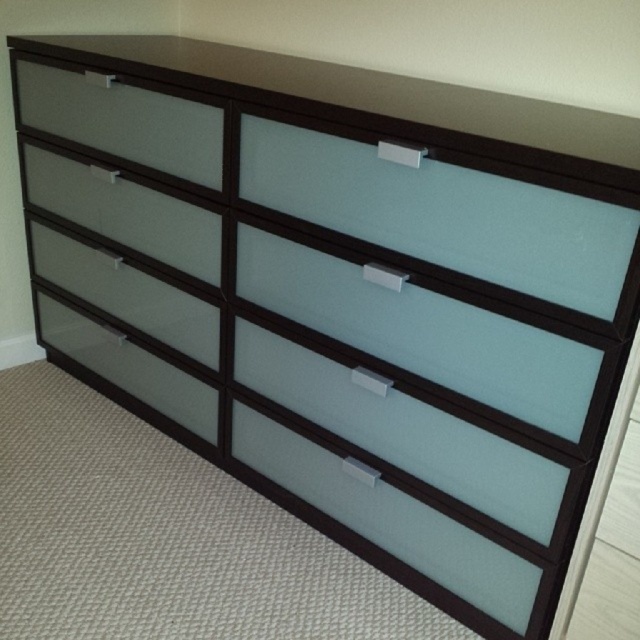
Is point (97, 140) closer to camera compared to point (132, 220)?

No, it is behind (132, 220).

Who is higher up, frosted glass drawer at upper left or satin glass drawer at upper left?

frosted glass drawer at upper left is above.

Between point (196, 129) and point (116, 232), which one is positioned behind?

The point (116, 232) is more distant.

The width and height of the screenshot is (640, 640). Identify the location of frosted glass drawer at upper left. (124, 120).

Looking at this image, between satin glass drawer at lower left and frosted glass drawer at lower left, which one has less height?

Standing shorter between the two is satin glass drawer at lower left.

Does satin glass drawer at lower left appear over frosted glass drawer at lower left?

Yes.

Which is behind, point (177, 312) or point (216, 412)?

The point (216, 412) is behind.

Identify the location of satin glass drawer at lower left. 128,292.

Is frosted glass drawer at upper left above satin glass drawer at lower left?

Yes, frosted glass drawer at upper left is above satin glass drawer at lower left.

Who is more forward, (x=132, y=109) or (x=45, y=273)?

Positioned in front is point (x=132, y=109).

Where is `frosted glass drawer at upper left`? The width and height of the screenshot is (640, 640). frosted glass drawer at upper left is located at coordinates (124, 120).